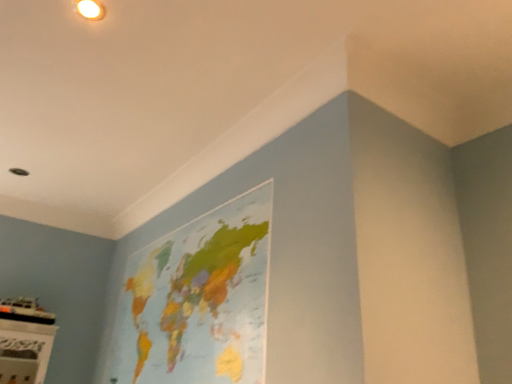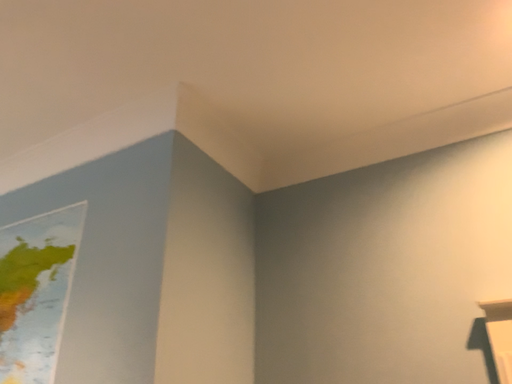
Question: How did the camera likely rotate when shooting the video?

Choices:
 (A) rotated right
 (B) rotated left

Answer: (A)